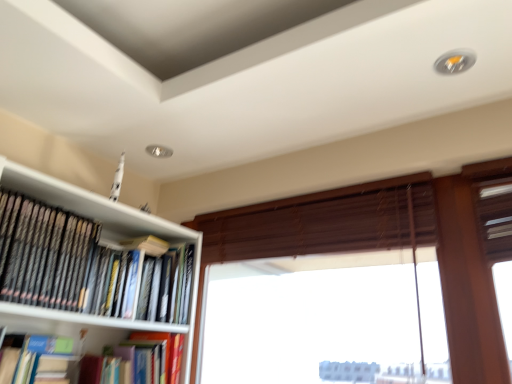
Question: From the image's perspective, is black matte bookshelf at upper left, which is the 1th book in top-to-bottom order, positioned above or below hardcover book at center, acting as the third book starting from the top?

Choices:
 (A) above
 (B) below

Answer: (A)

Question: Based on their sizes in the image, would you say black matte bookshelf at upper left, marked as the third book in a bottom-to-top arrangement, is bigger or smaller than hardcover book at center, which ranks as the first book in bottom-to-top order?

Choices:
 (A) big
 (B) small

Answer: (A)

Question: Estimate the real-world distances between objects in this image. Which object is closer to the hardcover book at center, which ranks as the first book in bottom-to-top order?

Choices:
 (A) blue matte book at lower left, the second book from the top
 (B) black matte bookshelf at upper left, which is the 1th book in top-to-bottom order
 (C) brown wood window at upper center
 (D) brown wooden blind at center

Answer: (A)

Question: Estimate the real-world distances between objects in this image. Which object is farther from the brown wooden blind at center?

Choices:
 (A) blue matte book at lower left, marked as the 2th book in a bottom-to-top arrangement
 (B) brown wood window at upper center
 (C) black matte bookshelf at upper left, which is the 1th book in top-to-bottom order
 (D) hardcover book at center, acting as the third book starting from the top

Answer: (A)